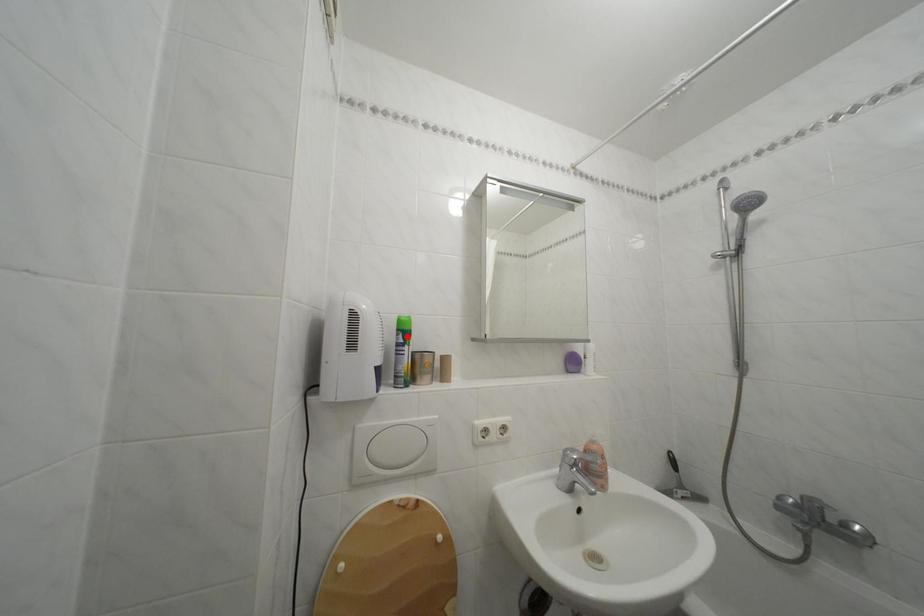
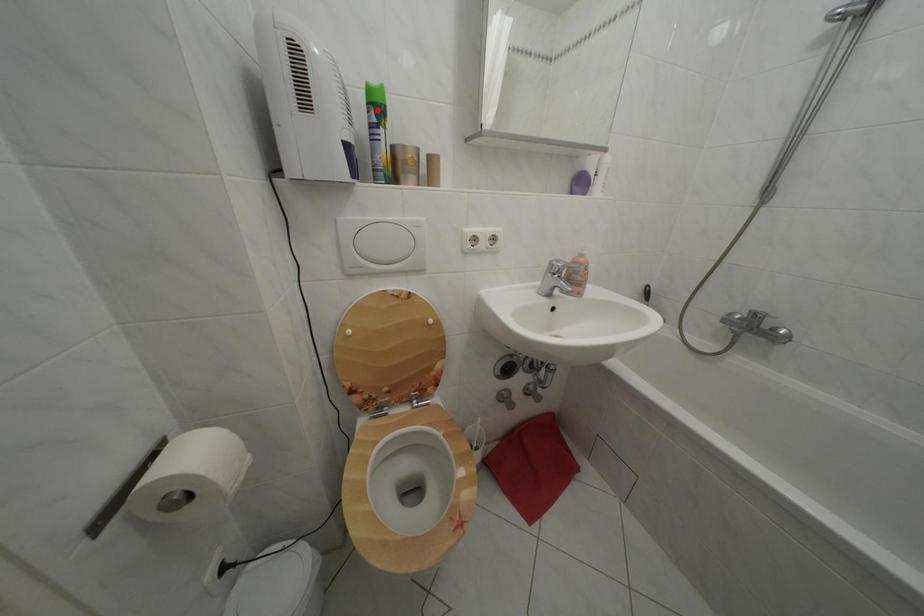
I am providing you with two images of the same scene from different viewpoints. A red point is marked on the first image and another point is marked on the second image. Do the highlighted points in image1 and image2 indicate the same real-world spot?

Yes